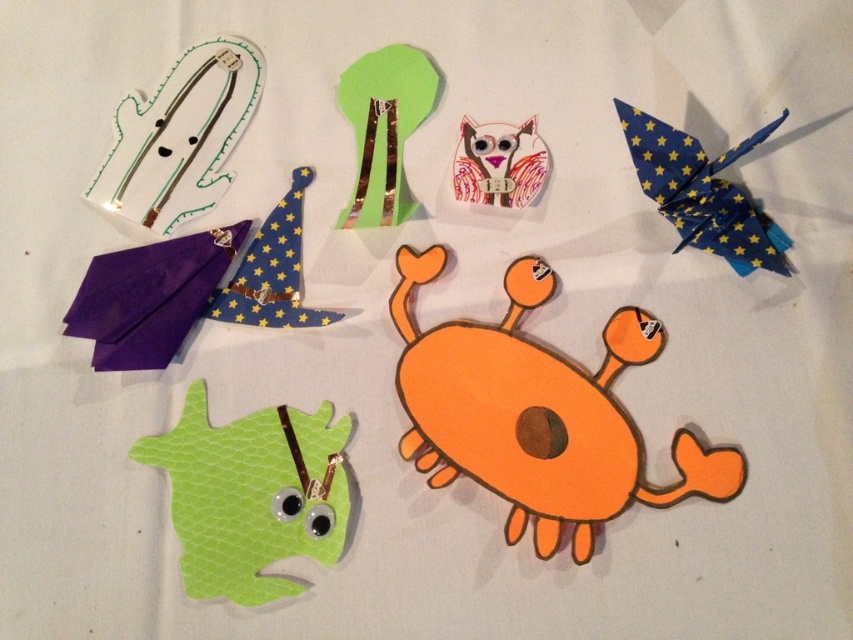
You are standing 5 feet away from a point labeled as point (369,157) in the image. Can you reach that point without moving closer?

The distance of point (369,157) from viewer is 4.52 feet, so yes, you can reach that point without moving closer since you are standing 5 feet away which is farther than the point.

Based on the photo, you are organizing a craft fair and need to display the green paper tree at upper center and the blue starry fabric wizard hat at upper left on a shelf. Which object should you place higher up to ensure both are visible?

Since the green paper tree at upper center is much taller than the blue starry fabric wizard hat at upper left, you should place the blue starry fabric wizard hat at upper left higher up on the shelf to ensure both are visible.

Consider the image. You are standing in front of the paper crafts displayed on the white surface. You see two points labeled as point 1 at coordinates (x=271, y=467) and point 2 at coordinates (x=769, y=232). Which point is closer to you?

Point 1 at coordinates (x=271, y=467) is closer to you because it is further to the viewer than point 2 at coordinates (x=769, y=232).